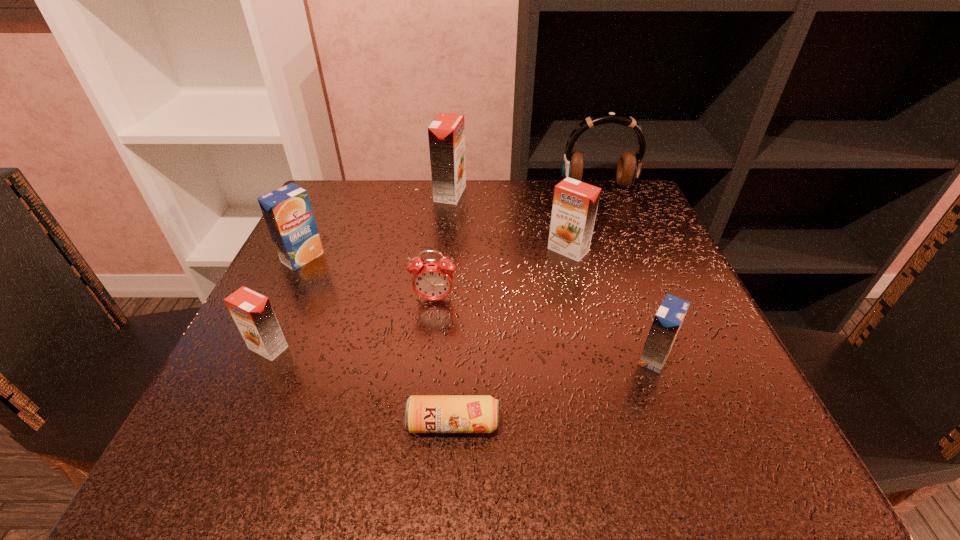
This screenshot has width=960, height=540. I want to click on the smaller blue orange_juice, so click(667, 322).

The image size is (960, 540). I want to click on the smallest orange orange juice, so click(252, 312).

Where is `the leftmost orange orange juice`? This screenshot has height=540, width=960. the leftmost orange orange juice is located at coordinates (252, 312).

What are the coordinates of `the shortest object` in the screenshot? It's located at (423, 413).

Identify the location of beer can. The image size is (960, 540). (423, 413).

Identify the location of free spot located 0.400m on the ear cup of the headset. (647, 310).

You are a GUI agent. You are given a task and a screenshot of the screen. Output one action in this format:
    pyautogui.click(x=<x>, y=<y>)
    Task: Click on the blank space located on the right of the second orange orange juice from right to left
    
    Given the screenshot: What is the action you would take?
    pyautogui.click(x=507, y=194)

Locate an element on the screen. The width and height of the screenshot is (960, 540). vacant area located on the front of the second biggest orange orange juice is located at coordinates (580, 297).

The width and height of the screenshot is (960, 540). What are the coordinates of `free space located on the front of the bigger blue orange_juice` in the screenshot? It's located at (238, 390).

Image resolution: width=960 pixels, height=540 pixels. What are the coordinates of `free space located on the face of the red alarm clock` in the screenshot? It's located at (429, 346).